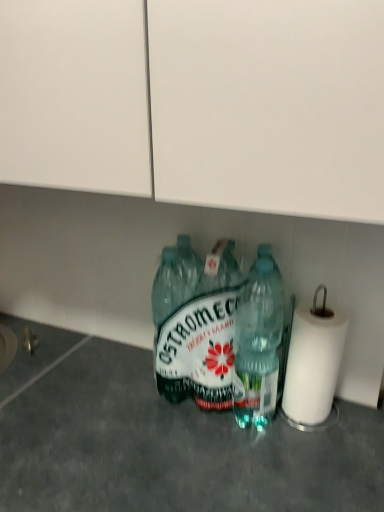
The image size is (384, 512). Identify the location of translucent plastic bottle at center, the first bottle from the right. (257, 346).

The height and width of the screenshot is (512, 384). What do you see at coordinates (257, 346) in the screenshot?
I see `translucent plastic bottle at center, acting as the 2th bottle starting from the left` at bounding box center [257, 346].

Describe the element at coordinates (312, 366) in the screenshot. I see `white paper at right` at that location.

Locate an element on the screen. transparent plastic bottles at center is located at coordinates (172, 448).

Can we say translucent plastic bottle at center, acting as the 2th bottle starting from the left, lies outside green plastic bottle at center, which ranks as the second bottle in right-to-left order?

Yes.

What's the angular difference between translucent plastic bottle at center, acting as the 2th bottle starting from the left, and green plastic bottle at center, which ranks as the second bottle in right-to-left order,'s facing directions?

The angle between the facing direction of translucent plastic bottle at center, acting as the 2th bottle starting from the left, and the facing direction of green plastic bottle at center, which ranks as the second bottle in right-to-left order, is 0.00118 degrees.

How far apart are translucent plastic bottle at center, the first bottle from the right, and green plastic bottle at center, which ranks as the second bottle in right-to-left order?

1.22 inches.

From the image's perspective, who appears lower, translucent plastic bottle at center, acting as the 2th bottle starting from the left, or green plastic bottle at center, which ranks as the second bottle in right-to-left order?

translucent plastic bottle at center, acting as the 2th bottle starting from the left, appears lower in the image.

Which is in front, white paper at right or translucent plastic bottle at center, acting as the 2th bottle starting from the left?

translucent plastic bottle at center, acting as the 2th bottle starting from the left, is more forward.

Is white paper at right not within translucent plastic bottle at center, acting as the 2th bottle starting from the left?

Absolutely, white paper at right is external to translucent plastic bottle at center, acting as the 2th bottle starting from the left.

Would you say white paper at right is to the left or to the right of translucent plastic bottle at center, the first bottle from the right, in the picture?

Clearly, white paper at right is on the right of translucent plastic bottle at center, the first bottle from the right, in the image.

Does white paper at right have a greater height compared to translucent plastic bottle at center, acting as the 2th bottle starting from the left?

In fact, white paper at right may be shorter than translucent plastic bottle at center, acting as the 2th bottle starting from the left.

Looking at their sizes, would you say transparent plastic bottles at center is wider or thinner than white paper at right?

transparent plastic bottles at center is wider than white paper at right.

How many degrees apart are the facing directions of transparent plastic bottles at center and white paper at right?

The angular difference between transparent plastic bottles at center and white paper at right is 3.71 degrees.

Does point (295, 448) come closer to viewer compared to point (342, 344)?

Yes, it is in front of point (342, 344).

Who is taller, green plastic bottle at center, which ranks as the second bottle in right-to-left order, or white paper at right?

green plastic bottle at center, which ranks as the second bottle in right-to-left order, is taller.

Is green plastic bottle at center, which appears as the first bottle when viewed from the left, thinner than white paper at right?

No, green plastic bottle at center, which appears as the first bottle when viewed from the left, is not thinner than white paper at right.

Based on their sizes in the image, would you say green plastic bottle at center, which appears as the first bottle when viewed from the left, is bigger or smaller than white paper at right?

Considering their sizes, green plastic bottle at center, which appears as the first bottle when viewed from the left, takes up more space than white paper at right.

Which of these two, translucent plastic bottle at center, the first bottle from the right, or white paper at right, is smaller?

translucent plastic bottle at center, the first bottle from the right, is smaller.

Can you confirm if translucent plastic bottle at center, the first bottle from the right, is taller than white paper at right?

Yes, translucent plastic bottle at center, the first bottle from the right, is taller than white paper at right.

Would you say translucent plastic bottle at center, acting as the 2th bottle starting from the left, is to the left or to the right of white paper at right in the picture?

translucent plastic bottle at center, acting as the 2th bottle starting from the left, is positioned on white paper at right's left side.

From a real-world perspective, is translucent plastic bottle at center, the first bottle from the right, on top of white paper at right?

Yes, from a real-world perspective, translucent plastic bottle at center, the first bottle from the right, is over white paper at right

Which of these two, transparent plastic bottles at center or green plastic bottle at center, which ranks as the second bottle in right-to-left order, is bigger?

transparent plastic bottles at center.

Locate an element on the screen. The image size is (384, 512). the 2nd bottle above when counting from the transparent plastic bottles at center (from the image's perspective) is located at coordinates click(x=228, y=338).

Considering the relative sizes of transparent plastic bottles at center and green plastic bottle at center, which ranks as the second bottle in right-to-left order, in the image provided, is transparent plastic bottles at center taller than green plastic bottle at center, which ranks as the second bottle in right-to-left order,?

Yes, transparent plastic bottles at center is taller than green plastic bottle at center, which ranks as the second bottle in right-to-left order.

Would you say transparent plastic bottles at center is inside or outside green plastic bottle at center, which appears as the first bottle when viewed from the left?

transparent plastic bottles at center lies outside green plastic bottle at center, which appears as the first bottle when viewed from the left.

Based on the photo, is transparent plastic bottles at center completely or partially outside of translucent plastic bottle at center, acting as the 2th bottle starting from the left?

transparent plastic bottles at center is positioned outside translucent plastic bottle at center, acting as the 2th bottle starting from the left.

From the image's perspective, between transparent plastic bottles at center and translucent plastic bottle at center, the first bottle from the right, which one is located above?

translucent plastic bottle at center, the first bottle from the right, from the image's perspective.

From a real-world perspective, which object stands above the other?

In real-world perspective, translucent plastic bottle at center, acting as the 2th bottle starting from the left, is above.

Identify the location of bottle directly beneath the green plastic bottle at center, which appears as the first bottle when viewed from the left (from a real-world perspective). This screenshot has height=512, width=384. (257, 346).

I want to click on bottle that is the 1st one above the white paper at right (from a real-world perspective), so click(257, 346).

When comparing their distances from white paper at right, does translucent plastic bottle at center, the first bottle from the right, or transparent plastic bottles at center seem closer?

The object closer to white paper at right is translucent plastic bottle at center, the first bottle from the right.

When comparing their distances from translucent plastic bottle at center, acting as the 2th bottle starting from the left, does white paper at right or transparent plastic bottles at center seem closer?

Based on the image, white paper at right appears to be nearer to translucent plastic bottle at center, acting as the 2th bottle starting from the left.

In the scene shown: Which object lies nearer to the anchor point translucent plastic bottle at center, acting as the 2th bottle starting from the left, green plastic bottle at center, which appears as the first bottle when viewed from the left, or transparent plastic bottles at center?

The object closer to translucent plastic bottle at center, acting as the 2th bottle starting from the left, is green plastic bottle at center, which appears as the first bottle when viewed from the left.

Estimate the real-world distances between objects in this image. Which object is further from transparent plastic bottles at center, white paper at right or green plastic bottle at center, which appears as the first bottle when viewed from the left?

white paper at right.

Based on their spatial positions, is green plastic bottle at center, which ranks as the second bottle in right-to-left order, or white paper at right closer to transparent plastic bottles at center?

green plastic bottle at center, which ranks as the second bottle in right-to-left order, is closer to transparent plastic bottles at center.

Looking at the image, which one is located further to translucent plastic bottle at center, acting as the 2th bottle starting from the left, white paper at right or green plastic bottle at center, which ranks as the second bottle in right-to-left order?

white paper at right.

Considering their positions, is transparent plastic bottles at center positioned closer to white paper at right than green plastic bottle at center, which appears as the first bottle when viewed from the left?

The object closer to white paper at right is green plastic bottle at center, which appears as the first bottle when viewed from the left.

Which object lies nearer to the anchor point transparent plastic bottles at center, translucent plastic bottle at center, the first bottle from the right, or green plastic bottle at center, which ranks as the second bottle in right-to-left order?

green plastic bottle at center, which ranks as the second bottle in right-to-left order.

Where is `paper towel between translucent plastic bottle at center, acting as the 2th bottle starting from the left, and transparent plastic bottles at center from top to bottom`? The image size is (384, 512). paper towel between translucent plastic bottle at center, acting as the 2th bottle starting from the left, and transparent plastic bottles at center from top to bottom is located at coordinates (312, 366).

Find the location of `paper towel between green plastic bottle at center, which appears as the first bottle when viewed from the left, and transparent plastic bottles at center, in the vertical direction`. paper towel between green plastic bottle at center, which appears as the first bottle when viewed from the left, and transparent plastic bottles at center, in the vertical direction is located at coordinates (312, 366).

Find the location of `bottle between green plastic bottle at center, which appears as the first bottle when viewed from the left, and transparent plastic bottles at center, in the vertical direction`. bottle between green plastic bottle at center, which appears as the first bottle when viewed from the left, and transparent plastic bottles at center, in the vertical direction is located at coordinates (257, 346).

This screenshot has width=384, height=512. I want to click on bottle between green plastic bottle at center, which ranks as the second bottle in right-to-left order, and white paper at right, in the horizontal direction, so click(x=257, y=346).